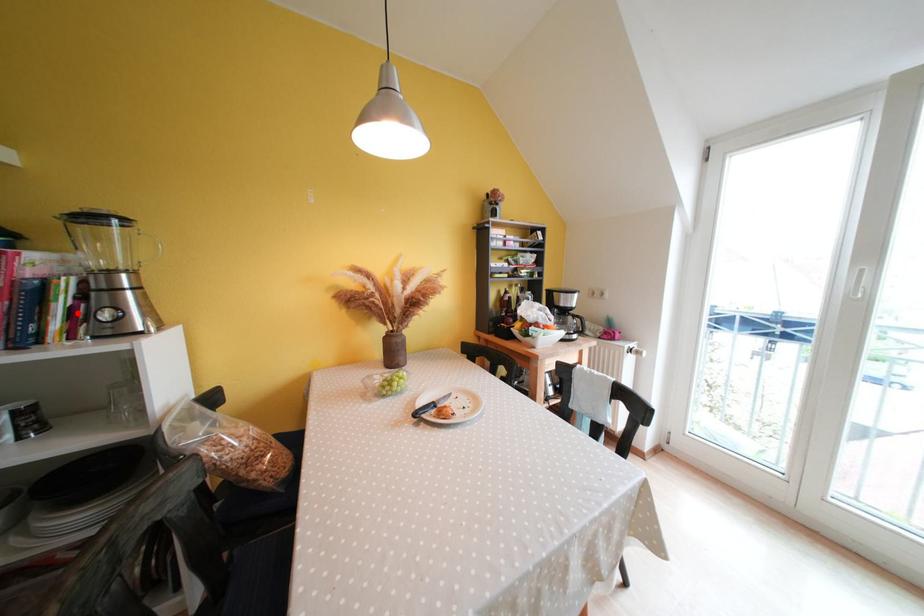
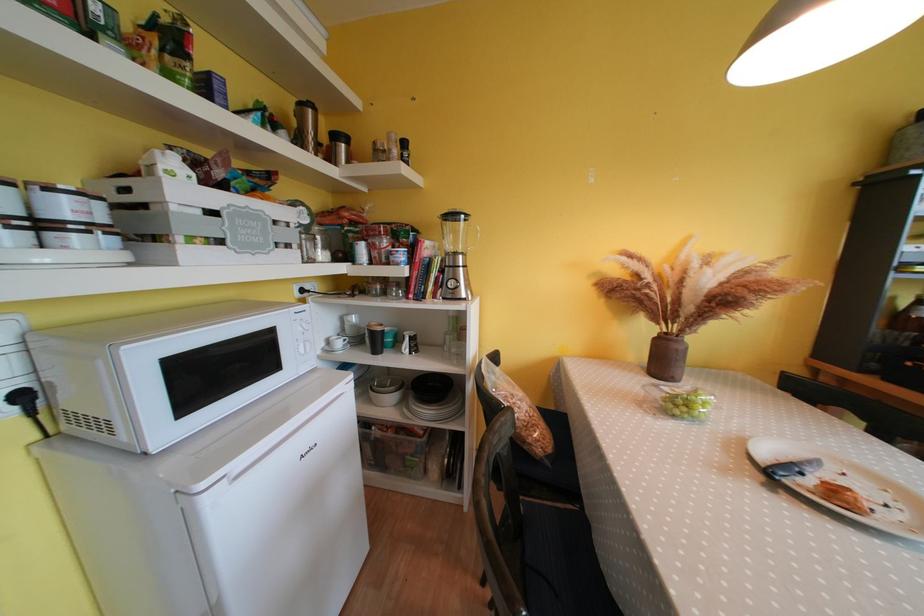
Find the pixel in the second image that matches the highlighted location in the first image.

(444, 282)